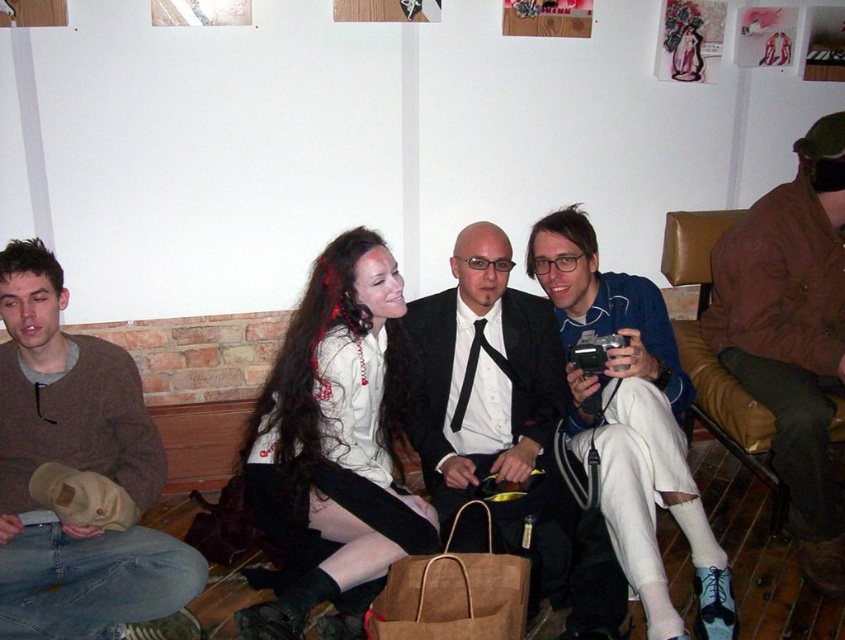
You are a photographer standing in front of the camera and want to take a closeup shot of the brown sweater at left. The camera has a minimum focusing distance of 1.5 meters. Can you take the photo without moving the camera or the sweater?

The brown sweater at left is 1.84 meters away from the camera, which is beyond the minimum focusing distance of 1.5 meters. Therefore, you can take the closeup shot without needing to move either the camera or the sweater.

You are a photographer setting up a camera to capture the group on the wooden bench. You need to ensure that both the brown sweater at left and the white matte pants at center are fully visible in the frame. Based on their widths, which object requires more horizontal space in the composition?

The brown sweater at left might require more horizontal space in the composition since it is wider than the white matte pants at center.

You are a photographer setting up for a group photo. You need to ensure that the white satin blouse at center and the matte black suit at center are both visible in the frame. Given their height difference, which one might you need to adjust the camera angle to focus on more?

The white satin blouse at center is shorter than the matte black suit at center. To ensure both are visible, you should angle the camera slightly downward to focus on the white satin blouse at center while still capturing the taller matte black suit at center.